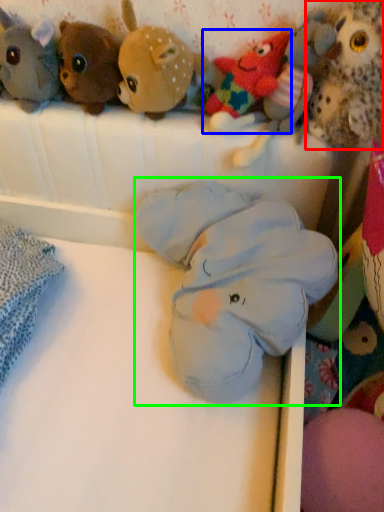
Question: Which is nearer to the toy (highlighted by a red box)? toy (highlighted by a blue box) or toy (highlighted by a green box).

Choices:
 (A) toy
 (B) toy

Answer: (A)